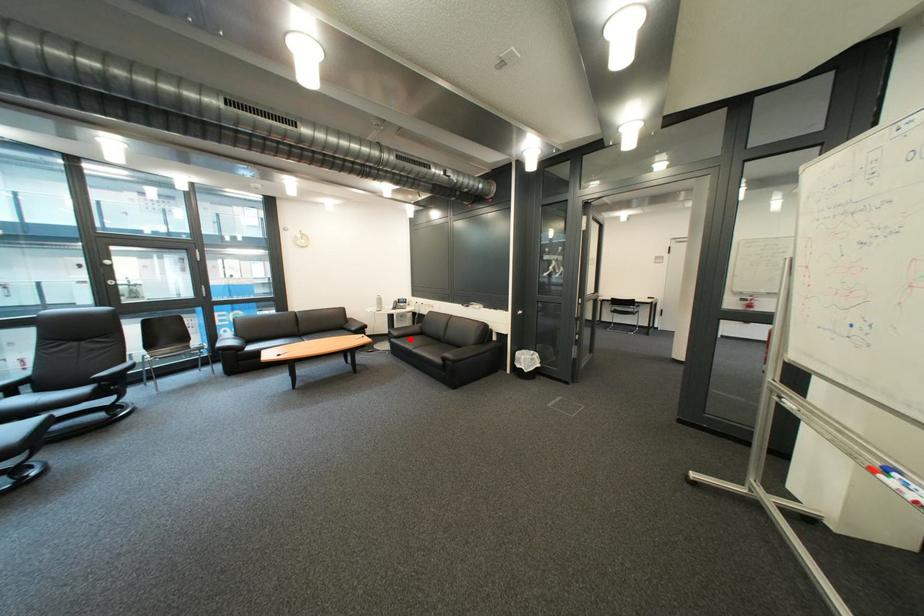
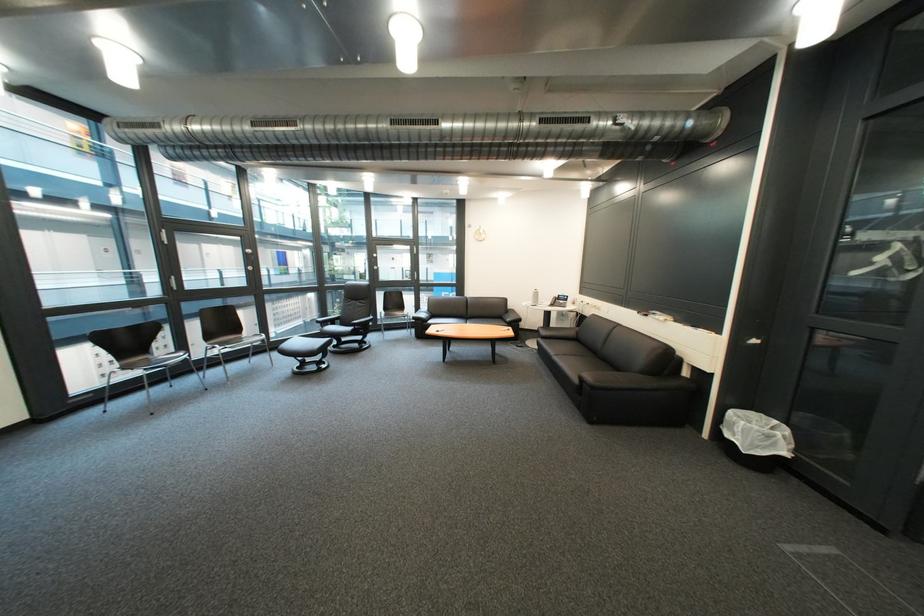
The point at the highlighted location is marked in the first image. Where is the corresponding point in the second image?

(556, 339)